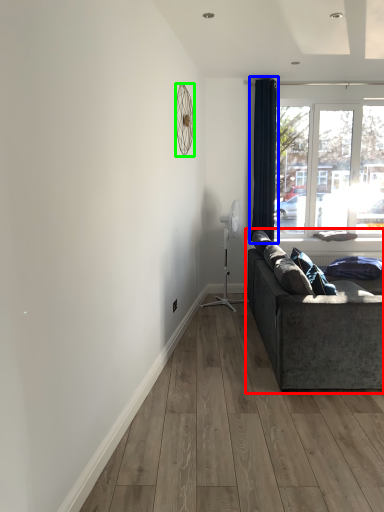
Question: Which object is positioned closest to studio couch (highlighted by a red box)? Select from curtain (highlighted by a blue box) and mechanical fan (highlighted by a green box).

Choices:
 (A) curtain
 (B) mechanical fan

Answer: (B)